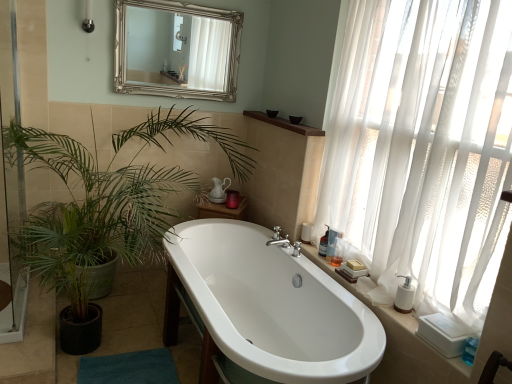
Question: Is blue fabric bath mat at lower left located outside white matte soap dispenser at right?

Choices:
 (A) no
 (B) yes

Answer: (B)

Question: Can you confirm if blue fabric bath mat at lower left is smaller than white matte soap dispenser at right?

Choices:
 (A) yes
 (B) no

Answer: (B)

Question: Is the position of blue fabric bath mat at lower left more distant than that of white matte soap dispenser at right?

Choices:
 (A) no
 (B) yes

Answer: (B)

Question: Considering the relative sizes of blue fabric bath mat at lower left and white matte soap dispenser at right in the image provided, is blue fabric bath mat at lower left bigger than white matte soap dispenser at right?

Choices:
 (A) yes
 (B) no

Answer: (A)

Question: Is blue fabric bath mat at lower left not near white matte soap dispenser at right?

Choices:
 (A) no
 (B) yes

Answer: (B)

Question: Is blue fabric bath mat at lower left at the right side of white matte soap dispenser at right?

Choices:
 (A) yes
 (B) no

Answer: (B)

Question: Is green leafy plant at upper left completely or partially inside transparent glass screen door at left?

Choices:
 (A) yes
 (B) no

Answer: (B)

Question: Is transparent glass screen door at left placed right next to green leafy plant at upper left?

Choices:
 (A) yes
 (B) no

Answer: (B)

Question: Is transparent glass screen door at left to the left of green leafy plant at upper left from the viewer's perspective?

Choices:
 (A) yes
 (B) no

Answer: (A)

Question: Are transparent glass screen door at left and green leafy plant at upper left located far from each other?

Choices:
 (A) yes
 (B) no

Answer: (B)

Question: Is transparent glass screen door at left positioned beyond the bounds of green leafy plant at upper left?

Choices:
 (A) no
 (B) yes

Answer: (A)

Question: Could you tell me if transparent glass screen door at left is facing green leafy plant at upper left?

Choices:
 (A) no
 (B) yes

Answer: (B)

Question: Does silver/gilded mirror at upper center turn towards translucent plastic bottle at right, the 1th toiletry positioned from the back?

Choices:
 (A) no
 (B) yes

Answer: (A)